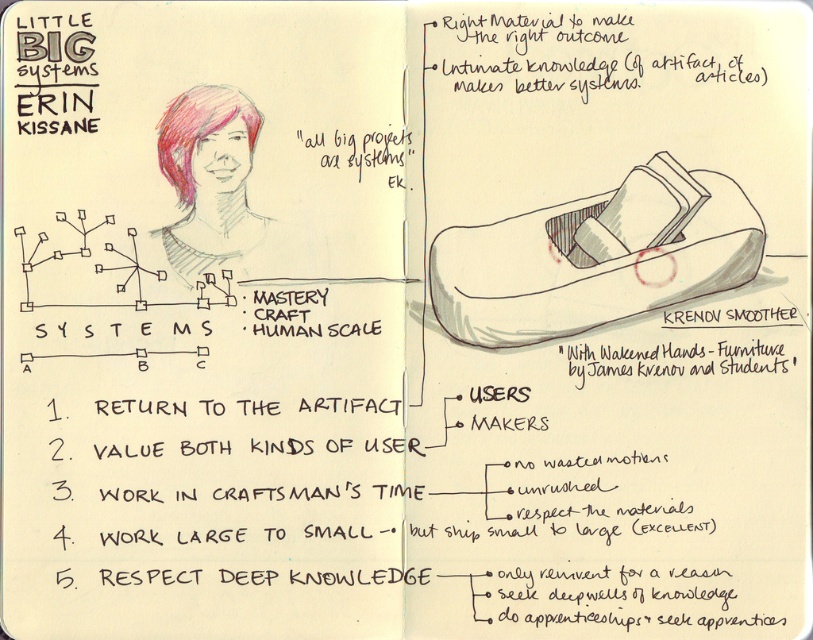
You are an interior designer who wants to place a 15 cm tall decorative item on the right side of a shelf. You have two options from the image, the matte gray wood shoe at upper right and the matte black artifact at upper right. Which one would fit better in terms of height?

The matte gray wood shoe at upper right is taller than the matte black artifact at upper right. Since the decorative item needs to be 15 cm tall, you should choose the matte gray wood shoe at upper right if you want a taller option or the matte black artifact at upper right if you prefer a shorter one. However, without knowing the exact heights, it is impossible to determine which one fits the 15 cm requirement perfectly.

You are an artist who wants to place a new drawing between the matte gray wood shoe at upper right and the matte black artifact at upper right on the sketchbook page. Based on their positions, which object should you place your drawing closer to if you want it to appear in front of both?

The matte gray wood shoe at upper right is closer to the viewer than the matte black artifact at upper right. To place your drawing in front of both, position it between them but closer to the matte gray wood shoe at upper right since it is already nearer to the viewer.